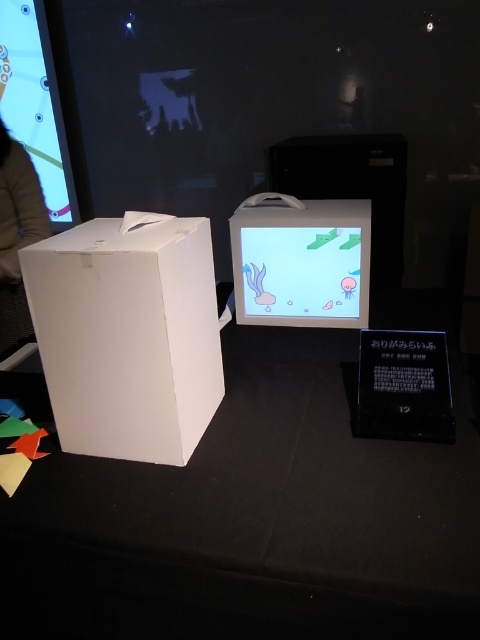
You are a photographer who wants to take a photo of the matte plastic screen at center. You have a camera that requires a minimum distance of 1.5 meters to avoid blurring. Is the camera positioned correctly to take a clear photo?

The matte plastic screen at center and camera are 1.60 meters apart. Since the required minimum distance is 1.5 meters, the camera is positioned correctly to avoid blurring and take a clear photo.

You are a visitor at the exhibition and want to take a photo of the black matte table at center without the brown leather jacket at left blocking the view. Is the jacket in the way?

The black matte table at center is closer to the viewer than the brown leather jacket at left, so the jacket is behind the table and not blocking the view.

You are an event organizer setting up for a fashion show. You have a brown leather jacket at left and a black matte table at center. Where should you place the jacket relative to the table according to the scene?

The brown leather jacket at left should be placed to the left of the black matte table at center since the black matte table at center is positioned on the right side of the brown leather jacket at left.